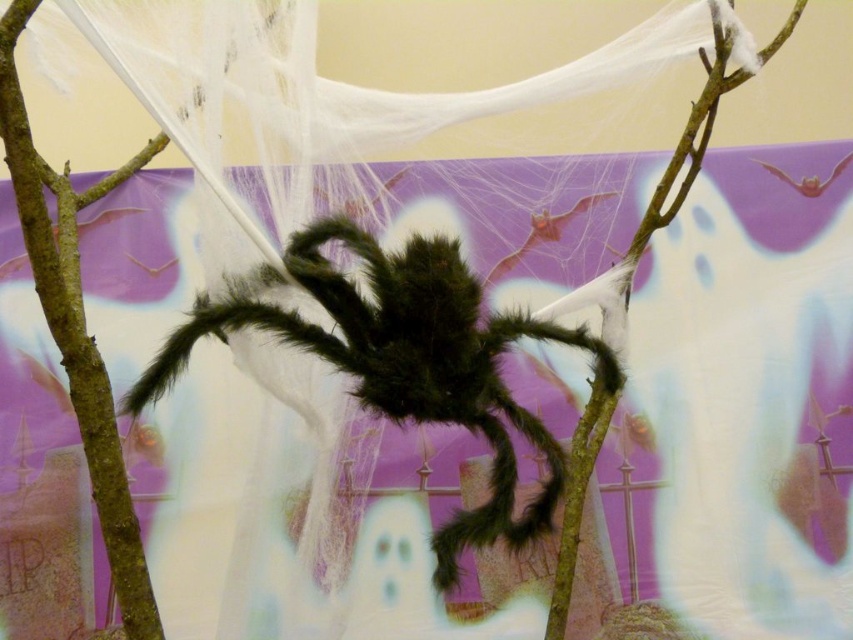
Is point (491, 406) farther from camera compared to point (73, 234)?

No, it is not.

Can you confirm if fuzzy black spider at center is positioned above brown rough tree branch at center?

Incorrect, fuzzy black spider at center is not positioned above brown rough tree branch at center.

What do you see at coordinates (403, 360) in the screenshot? I see `fuzzy black spider at center` at bounding box center [403, 360].

Locate an element on the screen. The height and width of the screenshot is (640, 853). fuzzy black spider at center is located at coordinates (403, 360).